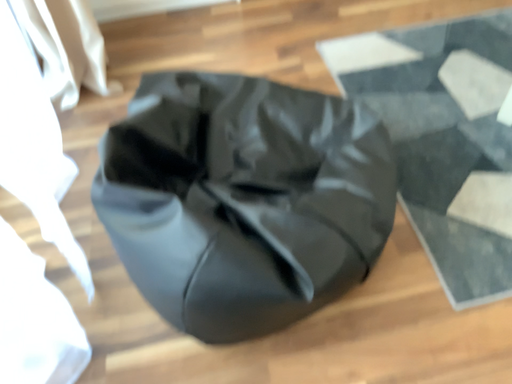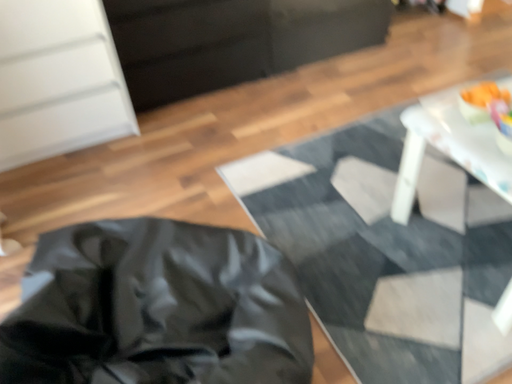
Question: Which way did the camera rotate in the video?

Choices:
 (A) rotated downward
 (B) rotated upward

Answer: (B)